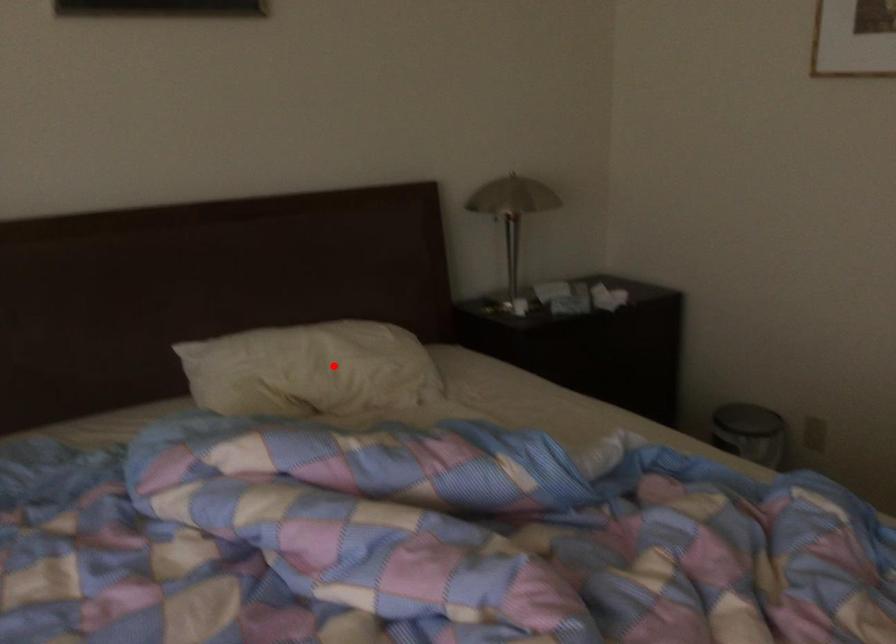
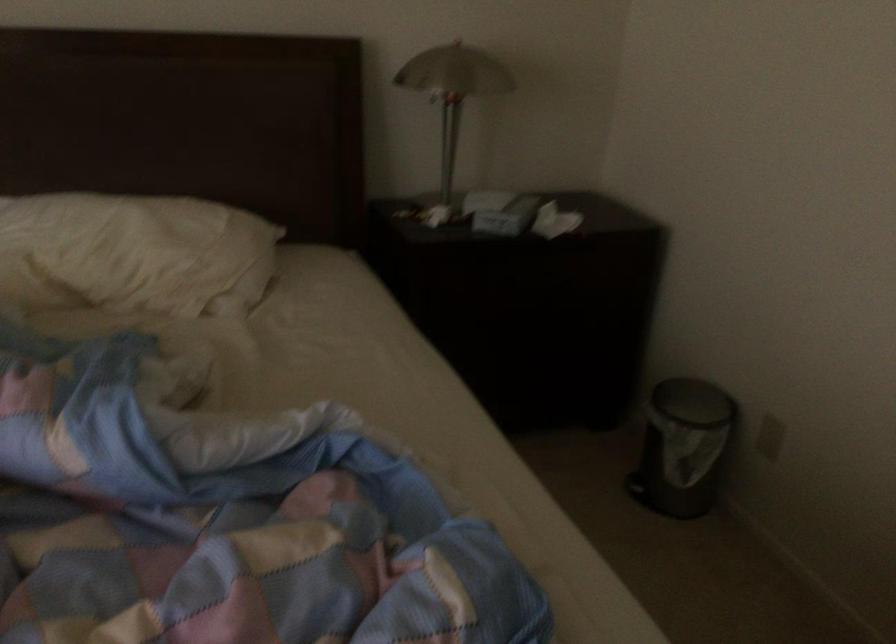
In the second image, find the point that corresponds to the highlighted location in the first image.

(133, 254)